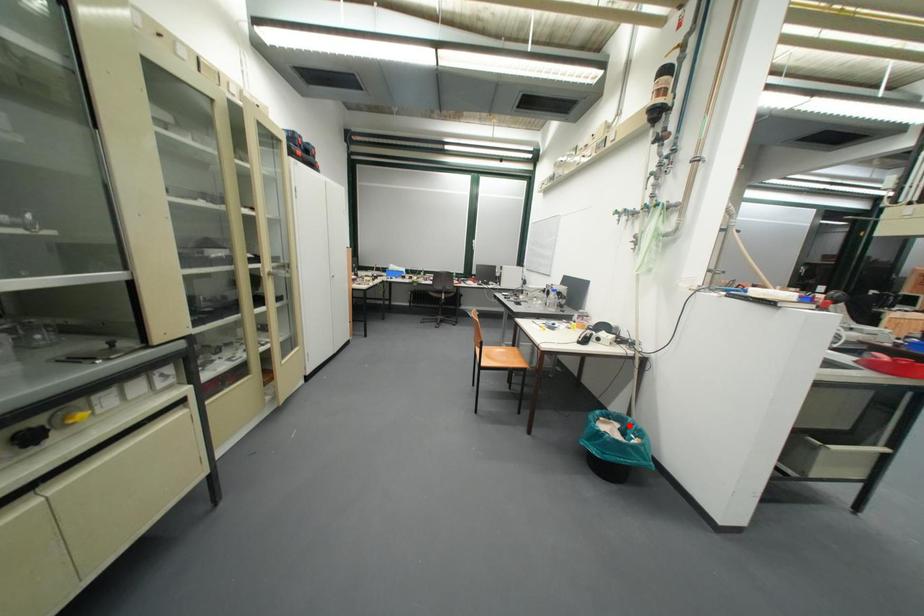
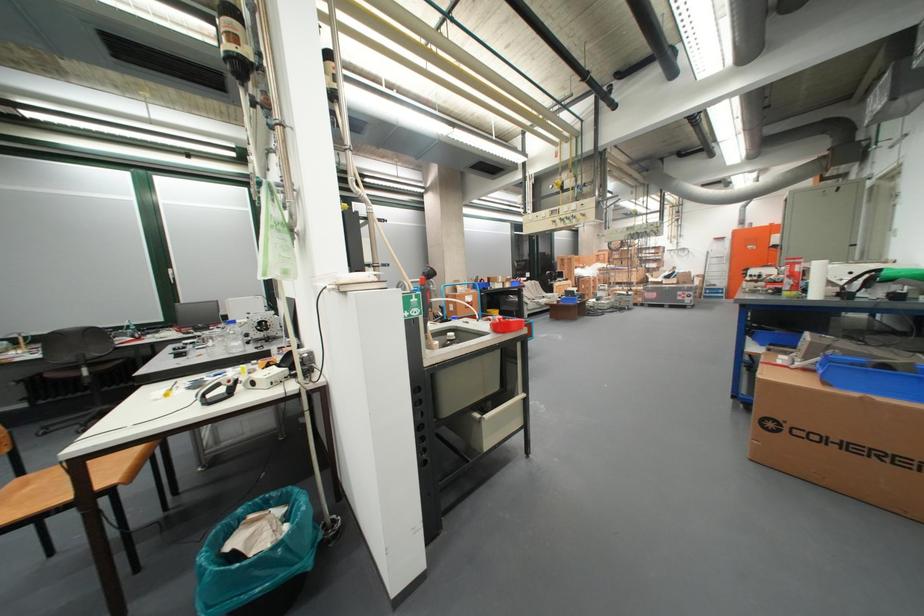
Find the pixel in the second image that matches the highlighted location in the first image.

(293, 512)